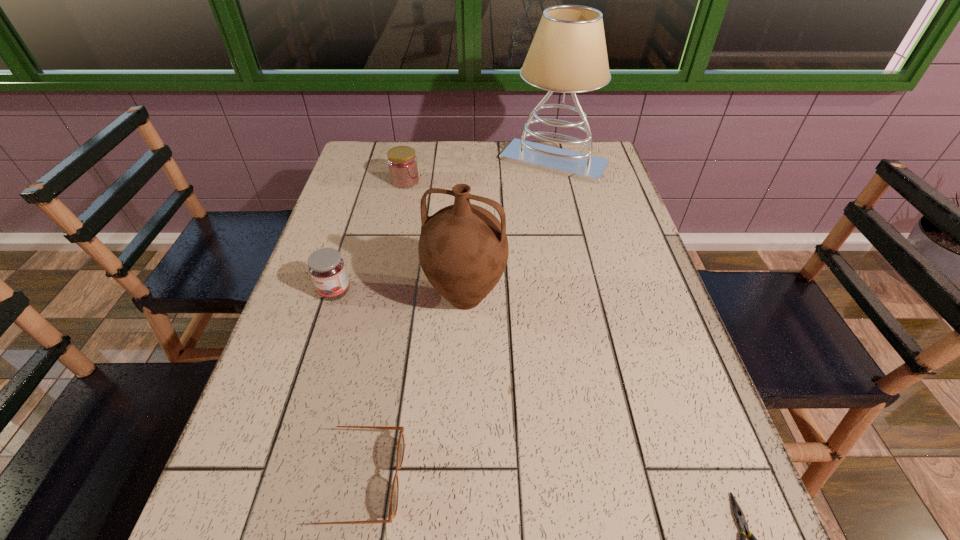
This screenshot has width=960, height=540. Identify the location of free space located 0.210m on the right of the farther jam. (487, 181).

Image resolution: width=960 pixels, height=540 pixels. What are the coordinates of `vacant point located on the front-facing side of the fifth tallest object` in the screenshot? It's located at (495, 480).

Locate an element on the screen. table lamp present at the far edge is located at coordinates (568, 54).

The image size is (960, 540). Identify the location of jam at the far edge. (402, 163).

The image size is (960, 540). I want to click on object positioned at the near edge, so click(x=393, y=506).

The width and height of the screenshot is (960, 540). I want to click on sunglasses that is at the left edge, so click(393, 506).

This screenshot has height=540, width=960. Find the location of `object located at the right edge`. object located at the right edge is located at coordinates (568, 54).

The image size is (960, 540). I want to click on object that is at the far left corner, so click(402, 163).

Where is `object that is positioned at the near left corner`? This screenshot has height=540, width=960. object that is positioned at the near left corner is located at coordinates (393, 506).

Where is `object located at the far right corner`? This screenshot has width=960, height=540. object located at the far right corner is located at coordinates (568, 54).